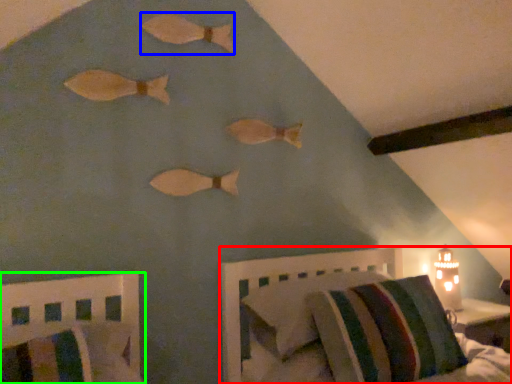
Question: Which object is positioned farthest from furniture (highlighted by a red box)? Select from animal (highlighted by a blue box) and furniture (highlighted by a green box).

Choices:
 (A) animal
 (B) furniture

Answer: (A)